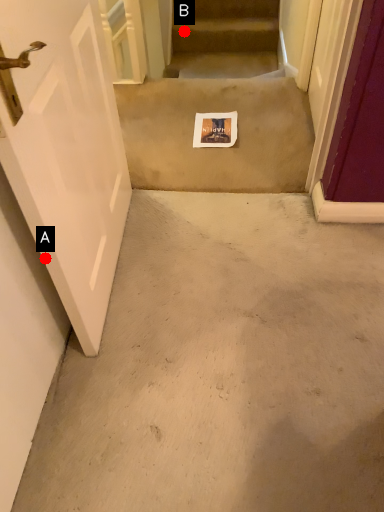
Question: Two points are circled on the image, labeled by A and B beside each circle. Which point is closer to the camera taking this photo?

Choices:
 (A) A is closer
 (B) B is closer

Answer: (A)